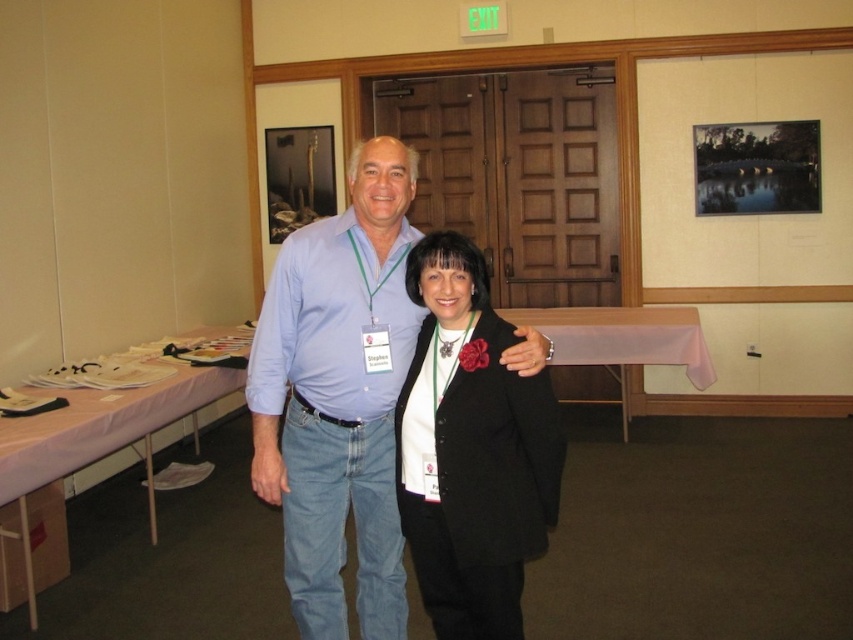
What do you see at coordinates (339, 396) in the screenshot?
I see `light blue cotton shirt at center` at bounding box center [339, 396].

Does point (347, 241) come closer to viewer compared to point (407, 380)?

No, it is behind (407, 380).

At what (x,y) coordinates should I click in order to perform the action: click on light blue cotton shirt at center. Please return your answer as a coordinate pair (x, y). Looking at the image, I should click on (339, 396).